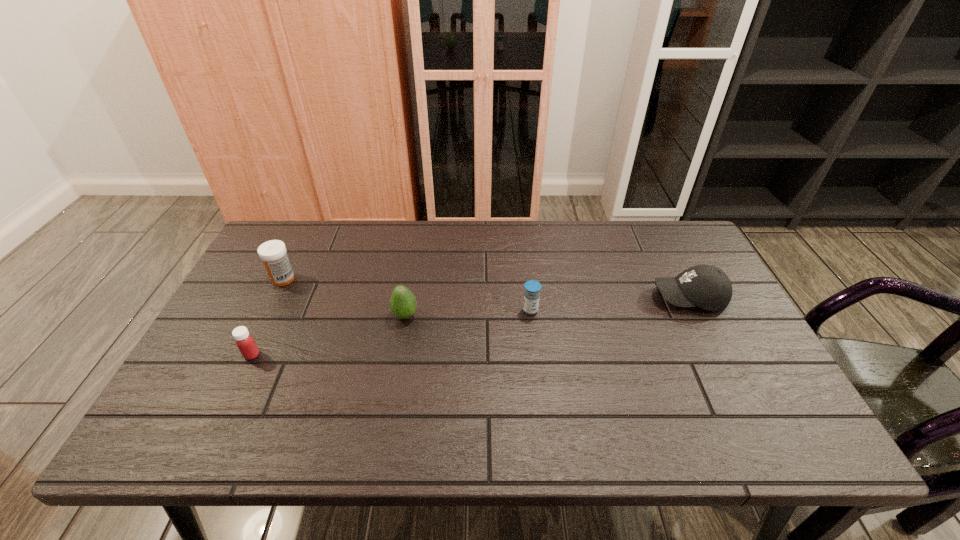
I want to click on vacant region between the farthest medicine and the nearest medicine, so click(x=268, y=317).

Where is `free spot between the rightmost object and the tallest medicine`? free spot between the rightmost object and the tallest medicine is located at coordinates (486, 288).

Where is `vacant area that lies between the avocado and the tallest medicine`? This screenshot has width=960, height=540. vacant area that lies between the avocado and the tallest medicine is located at coordinates (345, 297).

Where is `free space between the rightmost object and the avocado`? Image resolution: width=960 pixels, height=540 pixels. free space between the rightmost object and the avocado is located at coordinates (547, 307).

This screenshot has width=960, height=540. I want to click on vacant space in between the second farthest medicine and the nearest object, so click(x=391, y=333).

Where is `vacant area that lies between the rightmost medicine and the nearest object`? This screenshot has height=540, width=960. vacant area that lies between the rightmost medicine and the nearest object is located at coordinates [391, 333].

The width and height of the screenshot is (960, 540). In order to click on vacant space in between the second nearest medicine and the nearest object in this screenshot , I will do `click(391, 333)`.

This screenshot has width=960, height=540. Find the location of `unoccupied position between the second object from right to left and the rightmost object`. unoccupied position between the second object from right to left and the rightmost object is located at coordinates (610, 303).

This screenshot has width=960, height=540. What are the coordinates of `vacant area between the nearest object and the tallest medicine` in the screenshot? It's located at (268, 317).

Identify which object is located as the third nearest to the rightmost medicine. Please provide its 2D coordinates. Your answer should be formatted as a tuple, i.e. [(x, y)], where the tuple contains the x and y coordinates of a point satisfying the conditions above.

[(273, 253)]